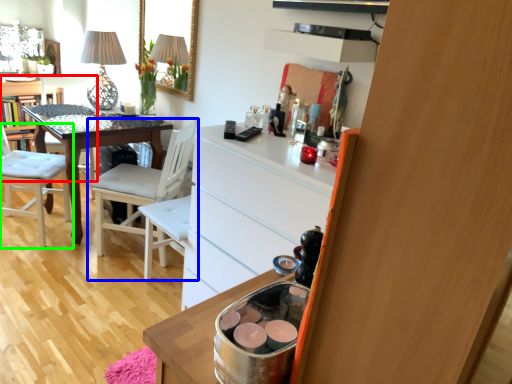
Question: Estimate the real-world distances between objects in this image. Which object is farther from chair (highlighted by a red box), chair (highlighted by a blue box) or chair (highlighted by a green box)?

Choices:
 (A) chair
 (B) chair

Answer: (A)